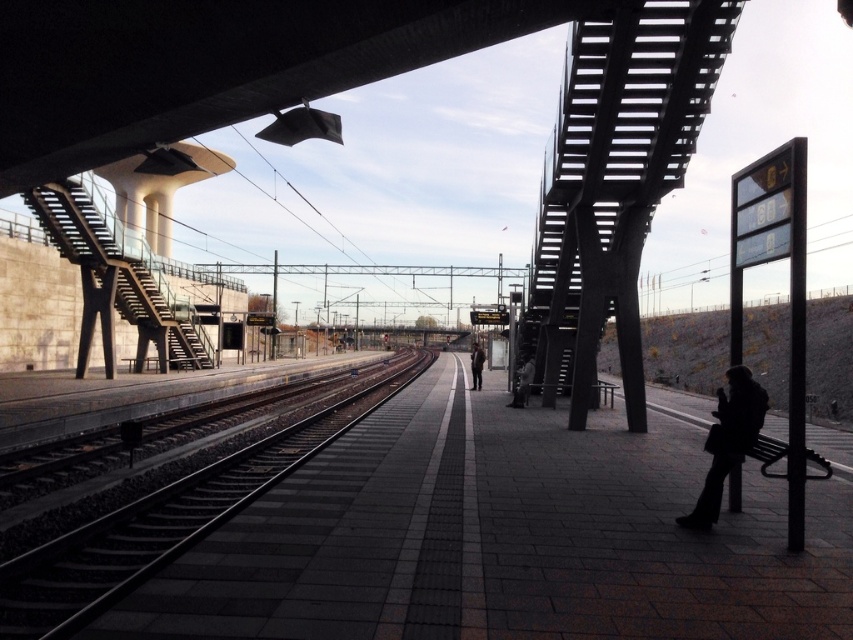
You are a passenger waiting for a train at the modern train station platform. You notice the dark gray metal train track at center and the dark gray jacket at center. Which object is positioned higher from the ground?

The dark gray jacket at center is positioned higher from the ground than the dark gray metal train track at center because the dark gray metal train track at center is located below it.

You are a commuter waiting on the platform and see both the dark gray jacket at center and the dark brown leather jacket at center. Which jacket is shorter in height?

The dark gray jacket at center is shorter in height compared to the dark brown leather jacket at center.

You are standing on the train station platform and want to walk from point A to point B. Point A is at coordinates point (717, 440) and point B is at coordinates point (520, 404). According to the scene description, which direction should you walk to move from point A to point B?

To move from point A at (717, 440) to point B at (520, 404), you should walk towards the lower left direction since point A is in front of point B, indicating that B is located behind and to the left of A.